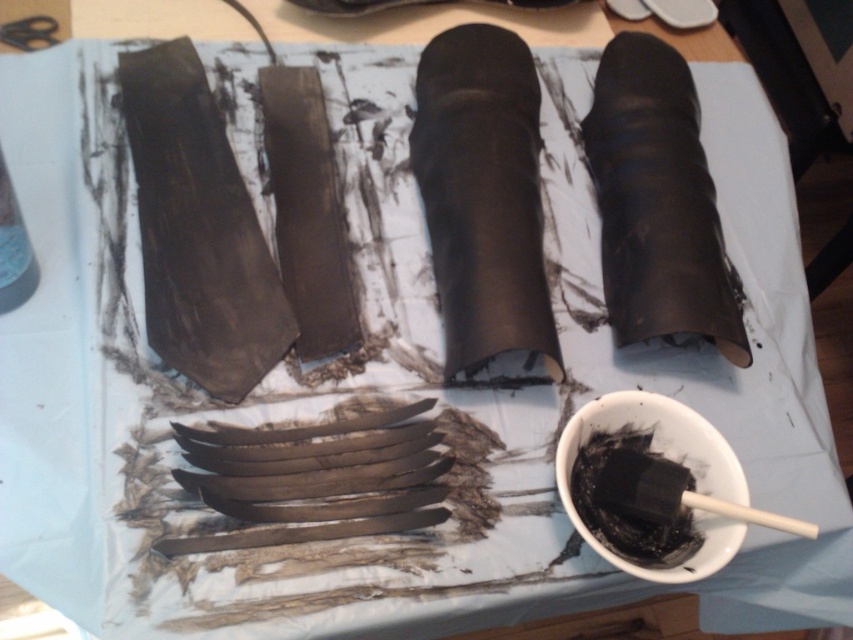
You are an artisan working on a project and need to place a new tool between the matte black boot at right and the black matte bowl at lower right. If the tool requires 15 centimeters of space, will there be enough room?

The distance between the matte black boot at right and the black matte bowl at lower right is 20.86 centimeters. Since the tool requires 15 centimeters, there is sufficient space to place it between them.

You are standing in front of a crafting workspace. There is a point marked at coordinates (x=444, y=252). If you want to place a tool that requires 2 feet of space to operate safely, will the available space from your current position to that point be sufficient?

The distance between your current position and the point is 36.44 inches, which is equivalent to 3.037 feet. Since the required space is 2 feet, the available space is sufficient for safely operating the tool.